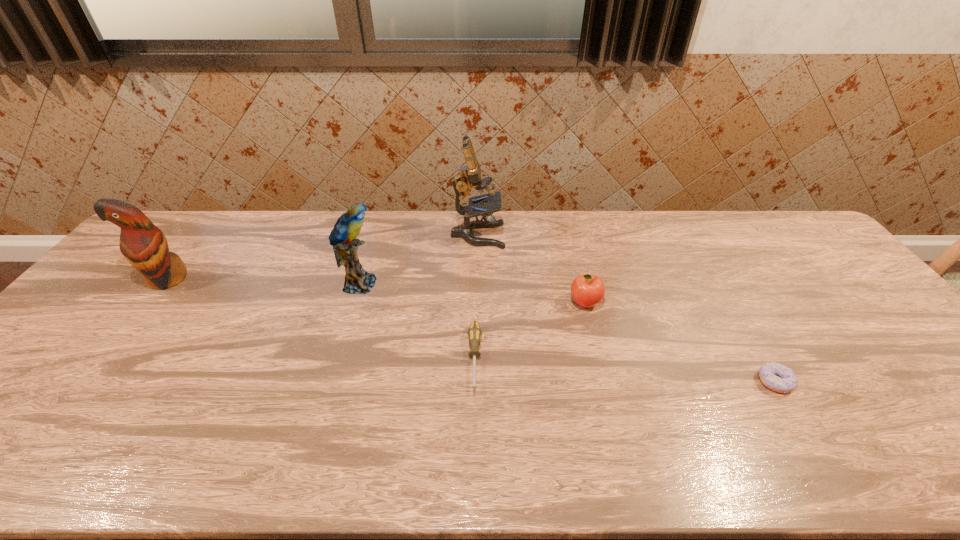
This screenshot has width=960, height=540. What are the coordinates of `vacant area at the far left corner` in the screenshot? It's located at (194, 235).

This screenshot has width=960, height=540. Identify the location of vacant point located between the doughnut and the farthest object. (626, 308).

Locate an element on the screen. free spot between the fourth tallest object and the farthest object is located at coordinates (531, 269).

Identify the location of empty location between the second object from right to left and the right parrot. Image resolution: width=960 pixels, height=540 pixels. (472, 293).

Image resolution: width=960 pixels, height=540 pixels. Find the location of `vacant area between the farthest object and the leftmost object`. vacant area between the farthest object and the leftmost object is located at coordinates (322, 257).

Identify the location of vacant space in between the screwdriver and the fifth object from right to left. The width and height of the screenshot is (960, 540). (417, 321).

This screenshot has width=960, height=540. I want to click on free point between the doughnut and the second object from right to left, so click(680, 342).

You are a GUI agent. You are given a task and a screenshot of the screen. Output one action in this format:
    pyautogui.click(x=<x>, y=<y>)
    Task: Click on the free area in between the fifth object from right to left and the leftmost object
    Image resolution: width=960 pixels, height=540 pixels.
    Given the screenshot: What is the action you would take?
    pyautogui.click(x=263, y=281)

I want to click on free space between the fourth tallest object and the left parrot, so click(375, 291).

Identify the location of vacant area between the tallest object and the apple. This screenshot has height=540, width=960. (531, 269).